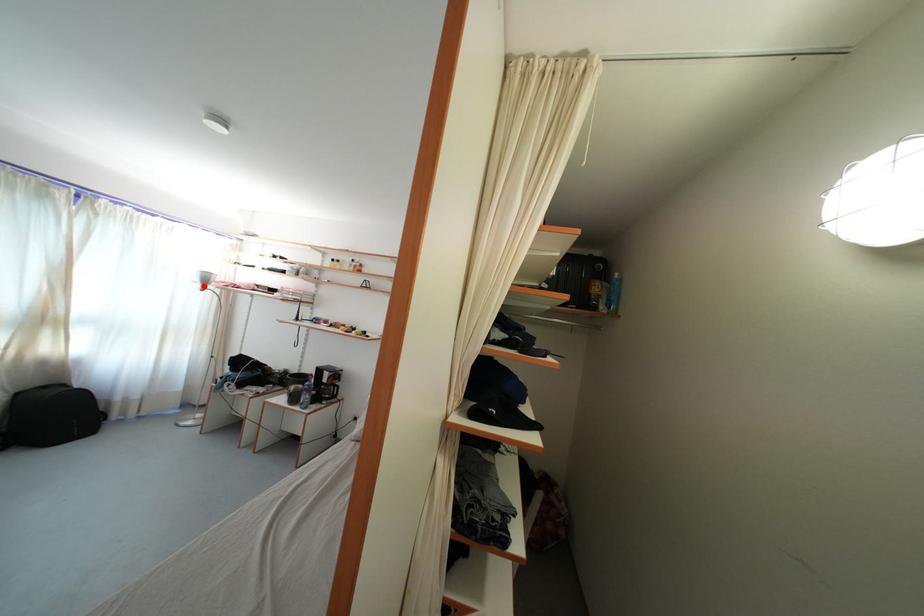
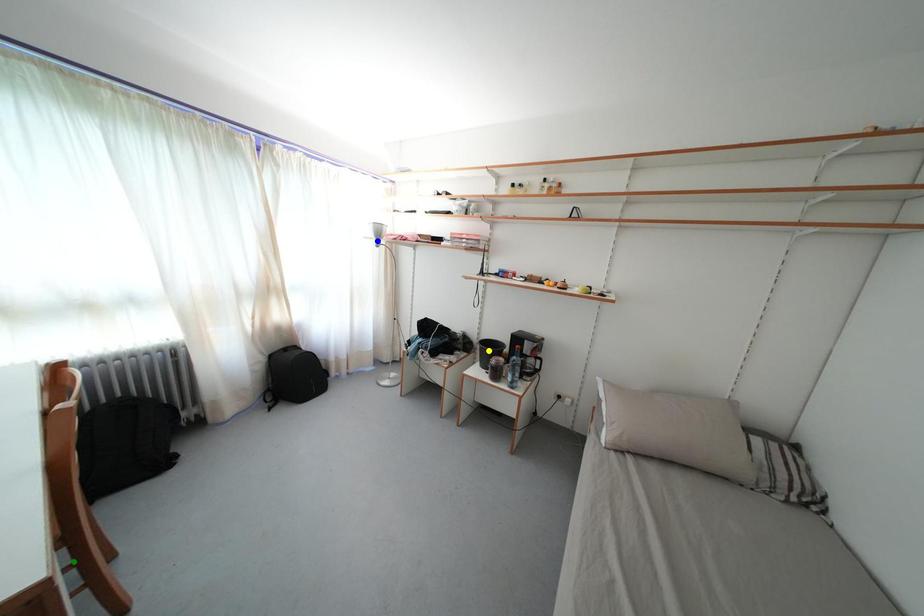
Question: I am providing you with two images of the same scene from different viewpoints. A red point is marked on the first image. You are given multiple points on the second image. In image 2, which mark is for the same physical point as the one in image 1?

Choices:
 (A) green point
 (B) yellow point
 (C) blue point

Answer: (C)